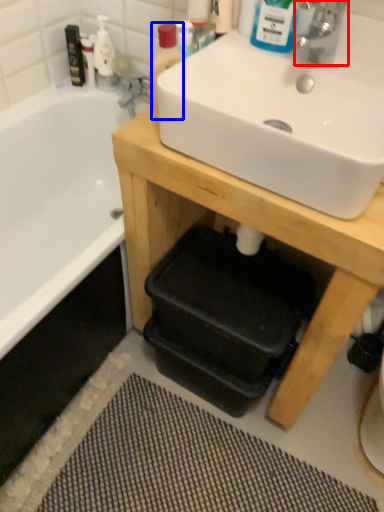
Question: Which of the following is the farthest to the observer, tap (highlighted by a red box) or bottle (highlighted by a blue box)?

Choices:
 (A) tap
 (B) bottle

Answer: (B)